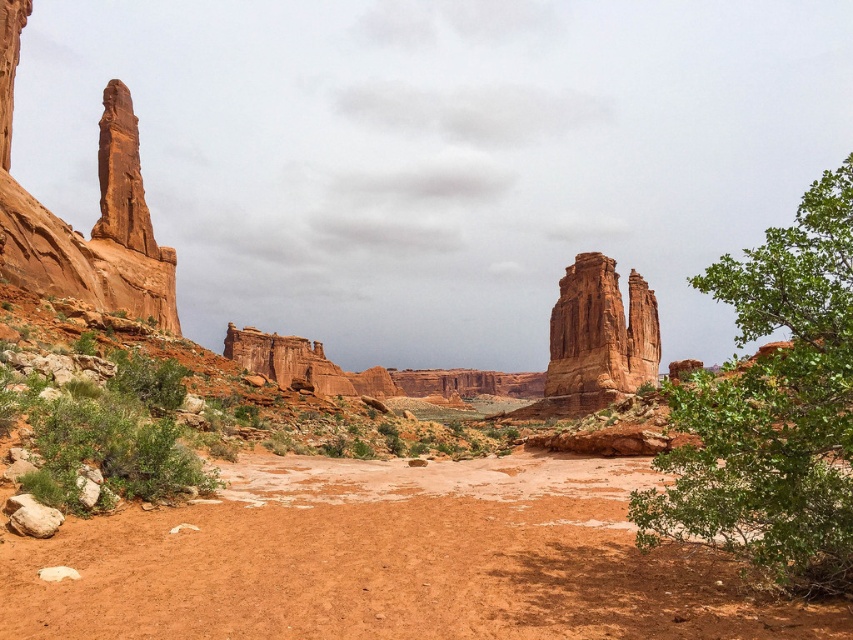
You are standing in the desert landscape and see two points marked in the image. The first point is at coordinates point (828, 298) and the second is at point (543, 388). Which point is closer to you?

Point (828, 298) is in front of point (543, 388), so it is closer to you.

You are a hiker trying to decide whether to place a 1.2 meter tall tent next to the green leafy bush at lower left. Considering the height of the rustic sandstone rock formation at center, will the tent be visible from there?

The green leafy bush at lower left is not as tall as the rustic sandstone rock formation at center, so the tent placed next to the green leafy bush at lower left may still be visible from the rustic sandstone rock formation at center depending on the exact height difference between the bush and the rock formation.

Looking at this image, you are planning to set up a tent for a camping trip and want to ensure it stays stable. Considering the green leafy tree at right and the rustic sandstone rock formation at center, which location would provide better wind protection?

The rustic sandstone rock formation at center would provide better wind protection because it is taller than the green leafy tree at right.